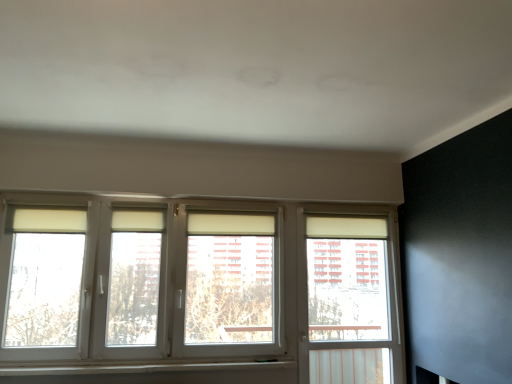
Question: Is the depth of white plastic window at center greater than that of white plastic window sill at lower center?

Choices:
 (A) yes
 (B) no

Answer: (B)

Question: Is white plastic window at center with white plastic window sill at lower center?

Choices:
 (A) no
 (B) yes

Answer: (A)

Question: From a real-world perspective, is white plastic window at center below white plastic window sill at lower center?

Choices:
 (A) yes
 (B) no

Answer: (B)

Question: Is white plastic window at center oriented towards white plastic window sill at lower center?

Choices:
 (A) no
 (B) yes

Answer: (A)

Question: Considering the relative sizes of white plastic window at center and white plastic window sill at lower center in the image provided, is white plastic window at center smaller than white plastic window sill at lower center?

Choices:
 (A) no
 (B) yes

Answer: (A)

Question: Would you say white plastic window sill at lower center is to the left or to the right of white plastic window at right in the picture?

Choices:
 (A) right
 (B) left

Answer: (B)

Question: Is point (1, 367) closer or farther from the camera than point (362, 344)?

Choices:
 (A) farther
 (B) closer

Answer: (B)

Question: From a real-world perspective, is white plastic window sill at lower center physically located above or below white plastic window at right?

Choices:
 (A) below
 (B) above

Answer: (A)

Question: Is white plastic window sill at lower center wider or thinner than white plastic window at right?

Choices:
 (A) thin
 (B) wide

Answer: (B)

Question: Is white plastic window at center in front of or behind white plastic window at right in the image?

Choices:
 (A) behind
 (B) front

Answer: (B)

Question: Based on their sizes in the image, would you say white plastic window at center is bigger or smaller than white plastic window at right?

Choices:
 (A) big
 (B) small

Answer: (A)

Question: From the image's perspective, relative to white plastic window at right, is white plastic window at center above or below?

Choices:
 (A) below
 (B) above

Answer: (B)

Question: From a real-world perspective, is white plastic window at center positioned above or below white plastic window at right?

Choices:
 (A) below
 (B) above

Answer: (B)

Question: Does point (388, 379) appear closer or farther from the camera than point (6, 375)?

Choices:
 (A) farther
 (B) closer

Answer: (A)

Question: Considering their positions, is white plastic window at right located in front of or behind white plastic window sill at lower center?

Choices:
 (A) front
 (B) behind

Answer: (B)